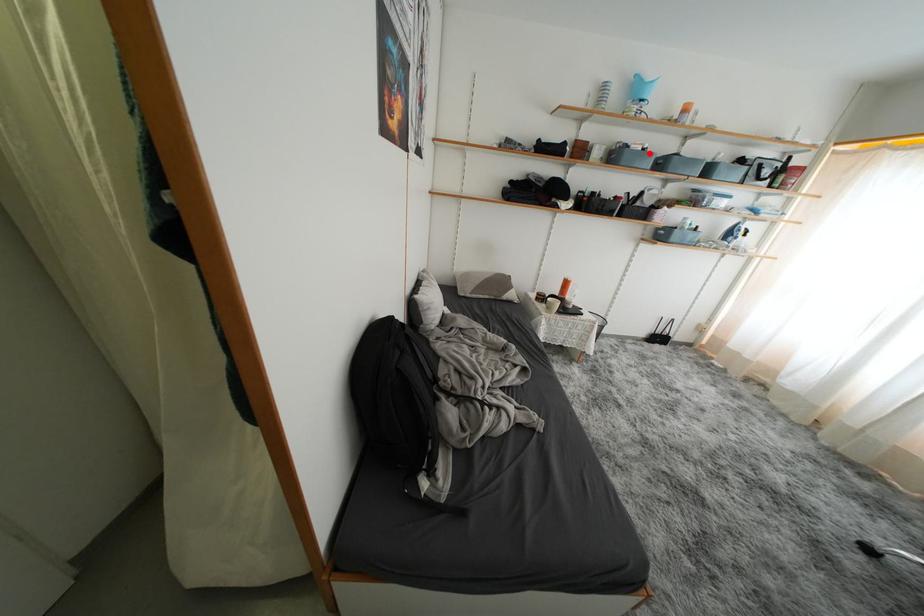
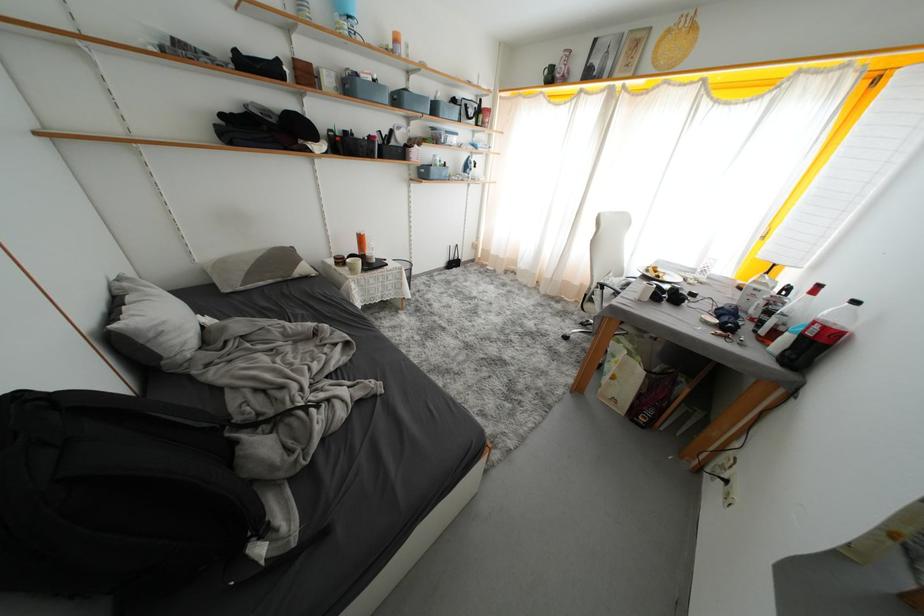
The point at the highlighted location is marked in the first image. Where is the corresponding point in the second image?

(381, 84)